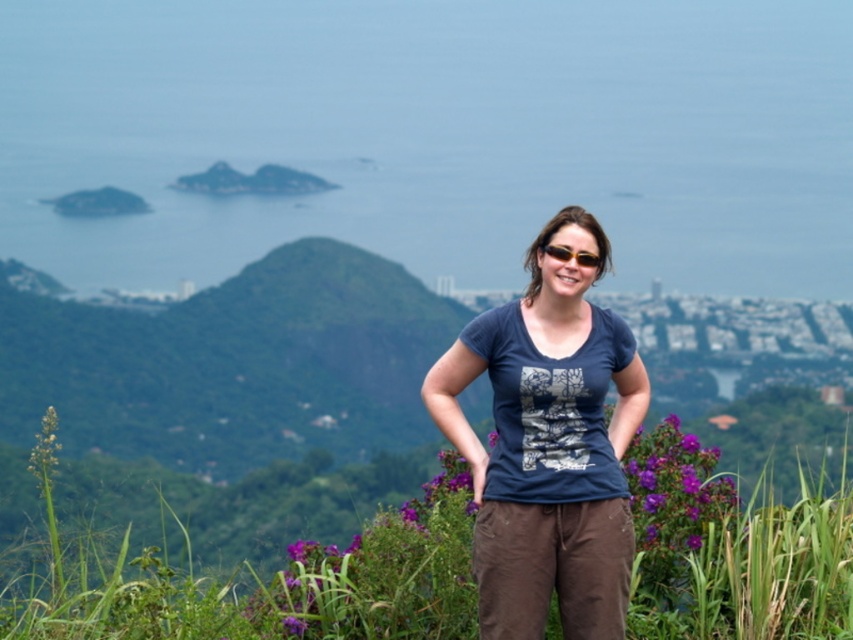
Question: Based on their relative distances, which object is nearer to the sunglasses at center?

Choices:
 (A) purple matte flower at center
 (B) blue cotton t-shirt at center

Answer: (B)

Question: Does blue cotton t-shirt at center have a lesser width compared to purple matte flower at center?

Choices:
 (A) no
 (B) yes

Answer: (A)

Question: Which object appears closest to the camera in this image?

Choices:
 (A) sunglasses at center
 (B) purple matte flower at center

Answer: (A)

Question: Can you confirm if blue cotton t-shirt at center is smaller than purple matte flower at center?

Choices:
 (A) yes
 (B) no

Answer: (B)

Question: Is purple matte flower at center wider than sunglasses at center?

Choices:
 (A) no
 (B) yes

Answer: (B)

Question: Among these points, which one is nearest to the camera?

Choices:
 (A) (692, 509)
 (B) (544, 244)

Answer: (B)